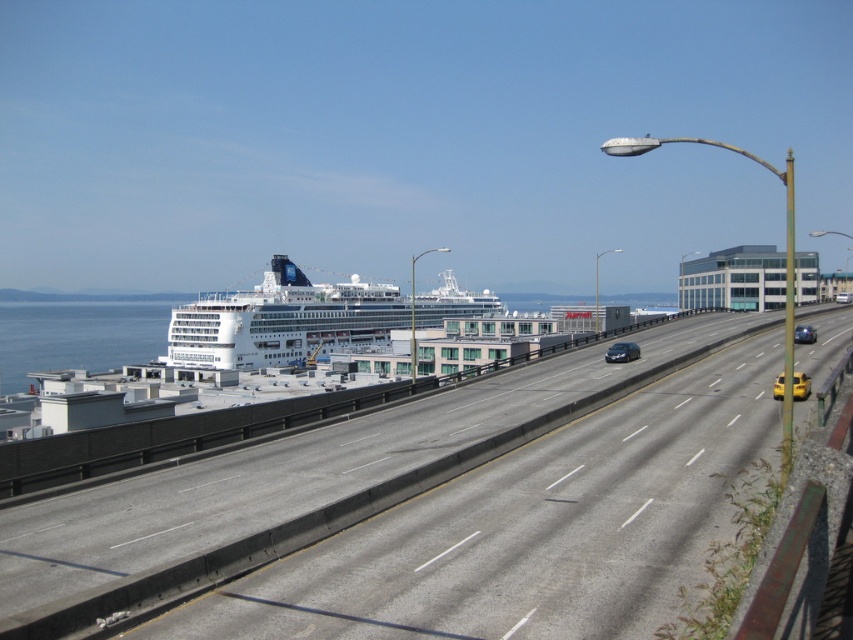
Question: Among these points, which one is nearest to the camera?

Choices:
 (A) (799, 387)
 (B) (158, 492)
 (C) (798, 328)

Answer: (B)

Question: Considering the real-world distances, which object is closest to the satin black sedan at center?

Choices:
 (A) white glossy cruise ship at center
 (B) yellow matte taxi at right
 (C) yellow matte taxi cab at center-right

Answer: (B)

Question: Where is gray asphalt highway at center located in relation to satin black sedan at center in the image?

Choices:
 (A) left
 (B) right

Answer: (A)

Question: Which object is farther from the camera taking this photo?

Choices:
 (A) satin black sedan at center
 (B) yellow matte taxi at right
 (C) gray asphalt highway at center
 (D) yellow matte taxi cab at center-right

Answer: (A)

Question: Is gray asphalt highway at center above yellow matte taxi cab at center-right?

Choices:
 (A) yes
 (B) no

Answer: (A)

Question: Can you confirm if gray asphalt highway at center is positioned to the right of white glossy cruise ship at center?

Choices:
 (A) no
 (B) yes

Answer: (B)